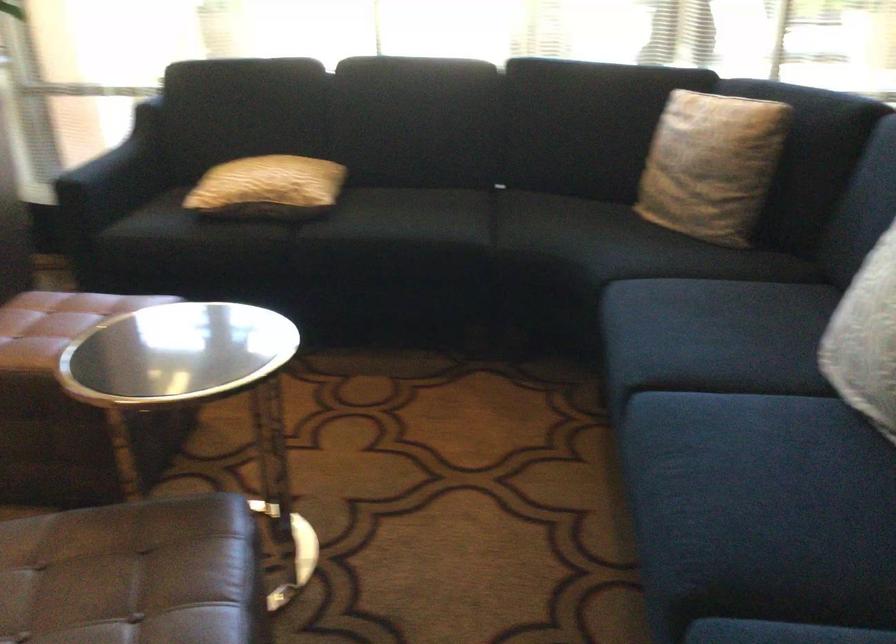
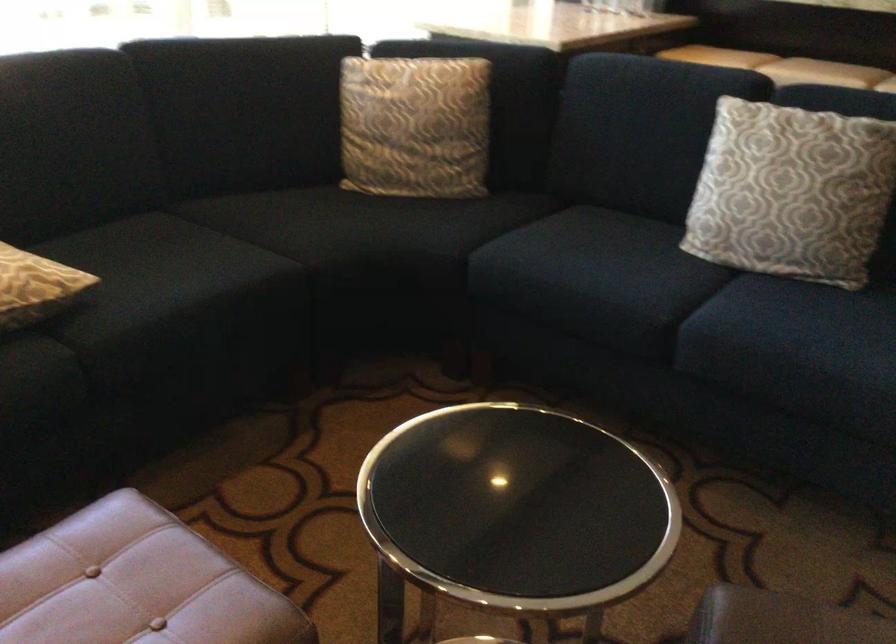
In the second image, find the point that corresponds to [665,325] in the first image.

(590, 274)